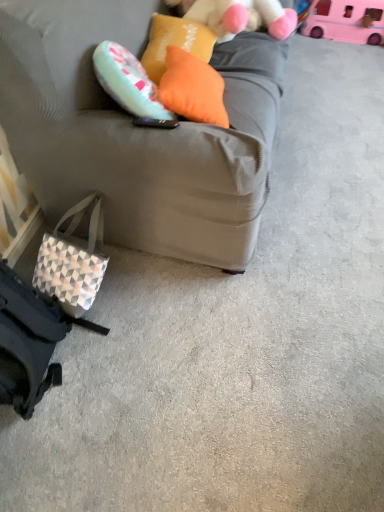
Question: Is geometric-patterned fabric pouch at lower left surrounding orange fabric pillow at upper center, the first pillow viewed from the back?

Choices:
 (A) yes
 (B) no

Answer: (B)

Question: Is geometric-patterned fabric pouch at lower left positioned with its back to orange fabric pillow at upper center, the first pillow viewed from the back?

Choices:
 (A) yes
 (B) no

Answer: (B)

Question: From a real-world perspective, is geometric-patterned fabric pouch at lower left positioned under orange fabric pillow at upper center, which is the 2th pillow from front to back, based on gravity?

Choices:
 (A) yes
 (B) no

Answer: (A)

Question: Is geometric-patterned fabric pouch at lower left in contact with orange fabric pillow at upper center, the first pillow viewed from the back?

Choices:
 (A) yes
 (B) no

Answer: (B)

Question: From the image's perspective, is geometric-patterned fabric pouch at lower left beneath orange fabric pillow at upper center, which is the 2th pillow from front to back?

Choices:
 (A) yes
 (B) no

Answer: (A)

Question: Is geometric-patterned fabric pouch at lower left positioned before orange fabric pillow at upper center, the first pillow viewed from the back?

Choices:
 (A) yes
 (B) no

Answer: (A)

Question: Does pink plastic toy at upper right have a larger size compared to geometric-patterned fabric pouch at lower left?

Choices:
 (A) yes
 (B) no

Answer: (A)

Question: Is pink plastic toy at upper right facing away from geometric-patterned fabric pouch at lower left?

Choices:
 (A) no
 (B) yes

Answer: (A)

Question: Considering the relative sizes of pink plastic toy at upper right and geometric-patterned fabric pouch at lower left in the image provided, is pink plastic toy at upper right taller than geometric-patterned fabric pouch at lower left?

Choices:
 (A) yes
 (B) no

Answer: (B)

Question: Is the depth of pink plastic toy at upper right less than that of geometric-patterned fabric pouch at lower left?

Choices:
 (A) no
 (B) yes

Answer: (A)

Question: From the image's perspective, is pink plastic toy at upper right under geometric-patterned fabric pouch at lower left?

Choices:
 (A) no
 (B) yes

Answer: (A)

Question: Does pink plastic toy at upper right have a greater width compared to geometric-patterned fabric pouch at lower left?

Choices:
 (A) no
 (B) yes

Answer: (A)

Question: Can you confirm if matte gray couch at center is positioned to the left of pink plastic toy at upper right?

Choices:
 (A) yes
 (B) no

Answer: (A)